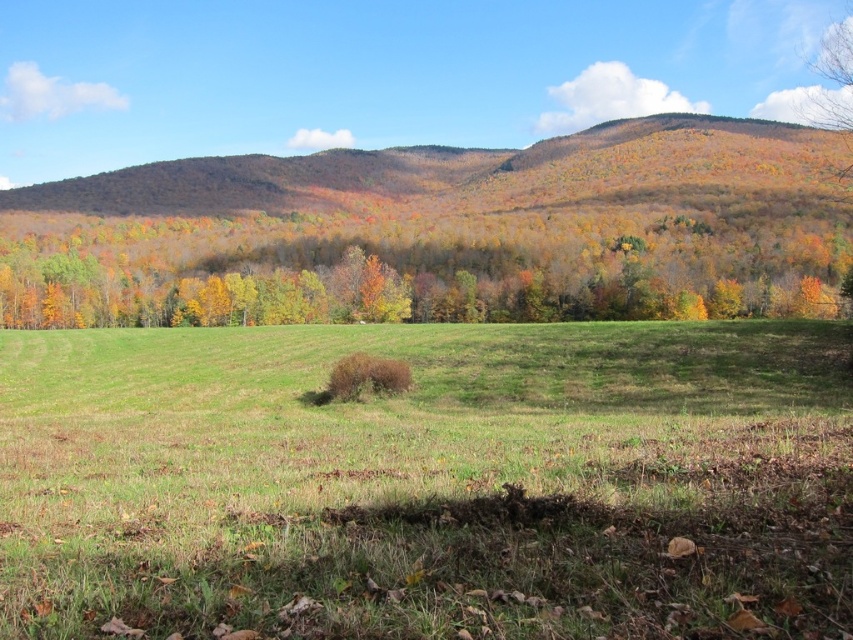
Is multicolored foliage at center thinner than autumn foliage hill at center?

Indeed, multicolored foliage at center has a lesser width compared to autumn foliage hill at center.

Does multicolored foliage at center have a lesser height compared to autumn foliage hill at center?

Yes, multicolored foliage at center is shorter than autumn foliage hill at center.

Between point (71, 300) and point (366, 184), which one is positioned in front?

Point (71, 300) is in front.

Where is `multicolored foliage at center`? The image size is (853, 640). multicolored foliage at center is located at coordinates (407, 273).

Does autumn foliage hill at center have a lesser height compared to smooth bark tree at upper right?

Correct, autumn foliage hill at center is not as tall as smooth bark tree at upper right.

Is point (827, 134) positioned in front of point (819, 61)?

Yes.

Where is `autumn foliage hill at center`? The width and height of the screenshot is (853, 640). autumn foliage hill at center is located at coordinates (468, 172).

Does point (728, 285) lie in front of point (817, 120)?

Yes, point (728, 285) is closer to viewer.

Can you confirm if multicolored foliage at center is bigger than smooth bark tree at upper right?

Actually, multicolored foliage at center might be smaller than smooth bark tree at upper right.

Is point (347, 304) positioned behind point (846, 104)?

Yes, point (347, 304) is behind point (846, 104).

What are the coordinates of `multicolored foliage at center` in the screenshot? It's located at (407, 273).